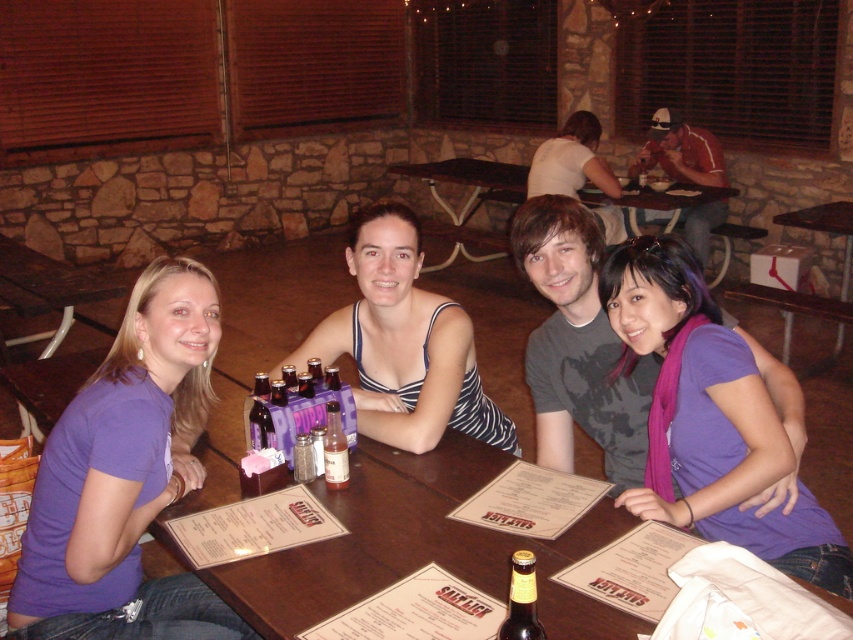
Is point (248, 426) in front of point (271, 424)?

No, (248, 426) is further to viewer.

Can you confirm if purple matte beer bottles at center is positioned above brown glass bottle at center?

Incorrect, purple matte beer bottles at center is not positioned above brown glass bottle at center.

Is point (292, 420) less distant than point (254, 381)?

Yes.

What are the coordinates of `purple matte beer bottles at center` in the screenshot? It's located at (297, 412).

Consider the image. Between purple cotton shirt at center and brown glass bottle at table center, which one appears on the right side from the viewer's perspective?

Positioned to the right is brown glass bottle at table center.

Who is more forward, (94, 531) or (527, 595)?

Positioned in front is point (527, 595).

This screenshot has width=853, height=640. What are the coordinates of `purple cotton shirt at center` in the screenshot? It's located at (126, 477).

Which is in front, point (624, 316) or point (343, 420)?

Positioned in front is point (624, 316).

Is purple soft scarf at center wider than purple matte beer bottles at center?

Correct, the width of purple soft scarf at center exceeds that of purple matte beer bottles at center.

Is point (778, 444) in front of point (291, 458)?

Yes, point (778, 444) is closer to viewer.

Find the location of a particular element. This screenshot has width=853, height=640. purple soft scarf at center is located at coordinates (709, 417).